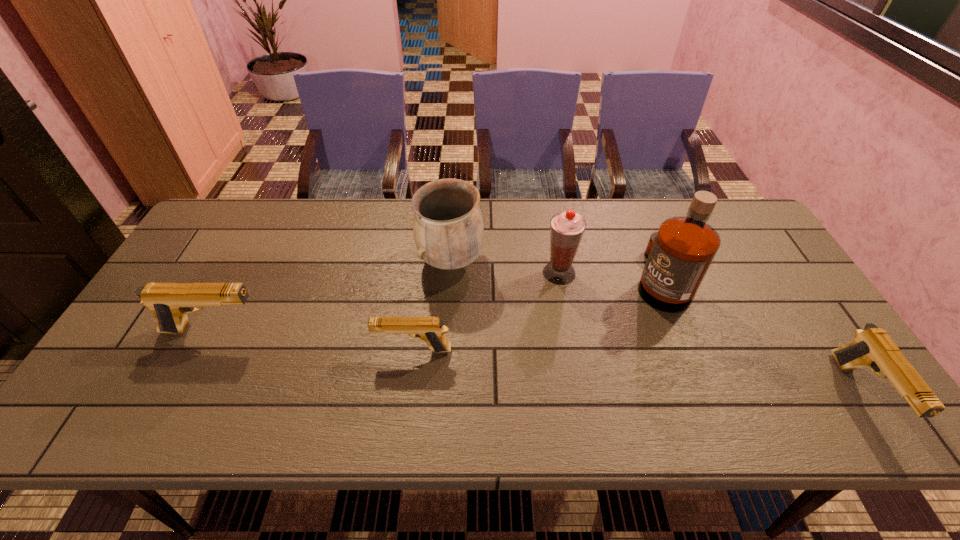
If the aim is uniform spacing by inserting an additional pistol among them, please point to a vacant space for this new pistol. Please provide its 2D coordinates. Your answer should be formatted as a tuple, i.e. [(x, y)], where the tuple contains the x and y coordinates of a point satisfying the conditions above.

[(628, 371)]